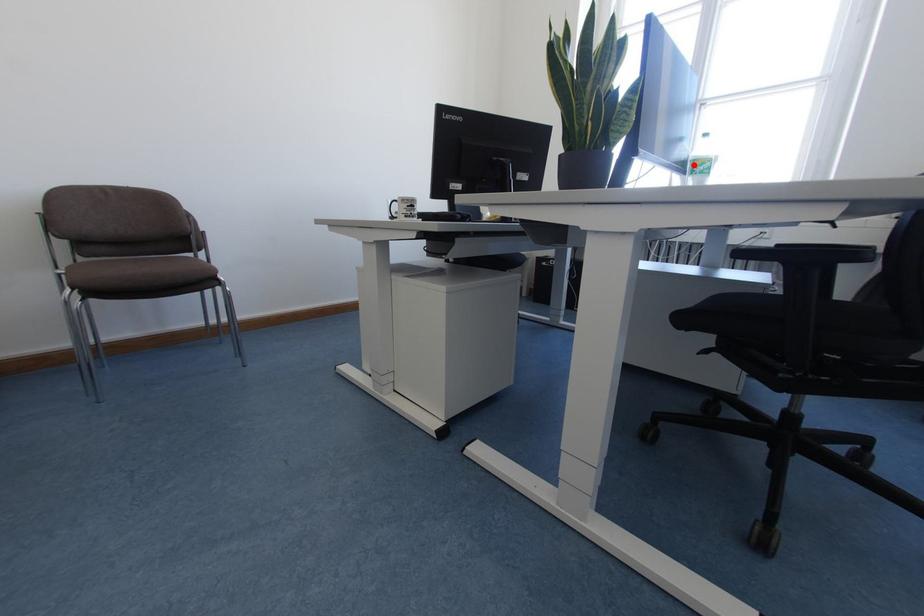
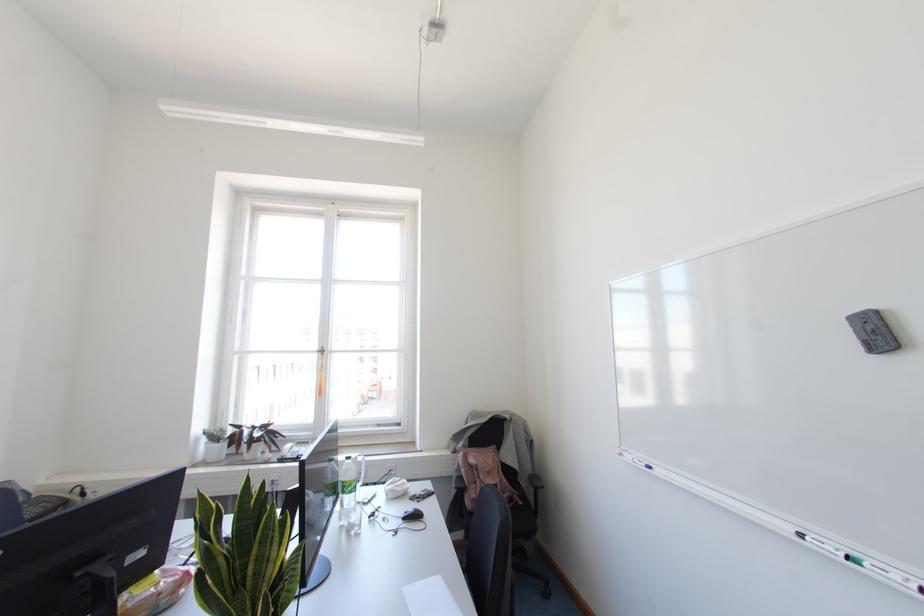
Find the pixel in the second image that matches the highlighted location in the first image.

(343, 485)